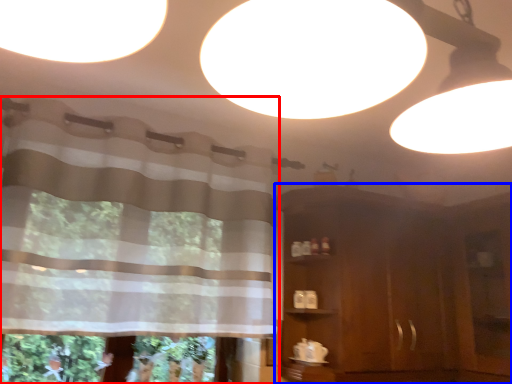
Question: Among these objects, which one is nearest to the camera, curtain (highlighted by a red box) or dresser (highlighted by a blue box)?

Choices:
 (A) curtain
 (B) dresser

Answer: (A)